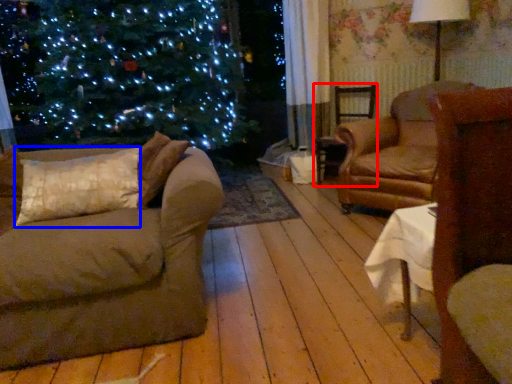
Question: Which of the following is the farthest to the observer, chair (highlighted by a red box) or pillow (highlighted by a blue box)?

Choices:
 (A) chair
 (B) pillow

Answer: (A)